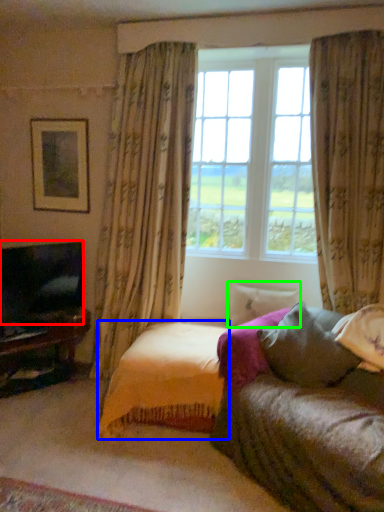
Question: Which is farther away from television (highlighted by a red box)? bedding (highlighted by a blue box) or pillow (highlighted by a green box)?

Choices:
 (A) bedding
 (B) pillow

Answer: (B)